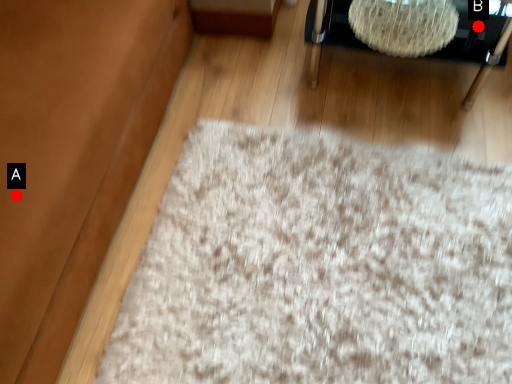
Question: Two points are circled on the image, labeled by A and B beside each circle. Which point is closer to the camera?

Choices:
 (A) A is closer
 (B) B is closer

Answer: (A)